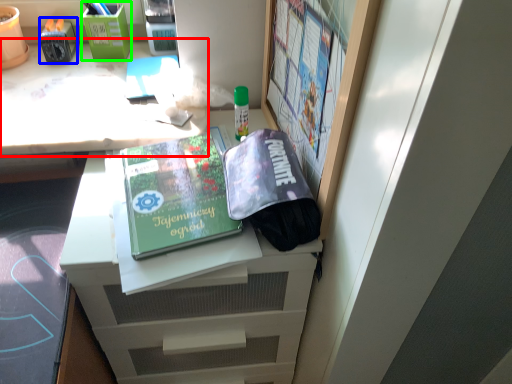
Question: Estimate the real-world distances between objects in this image. Which object is closer to desk (highlighted by a red box), stationery (highlighted by a blue box) or stationery (highlighted by a green box)?

Choices:
 (A) stationery
 (B) stationery

Answer: (B)